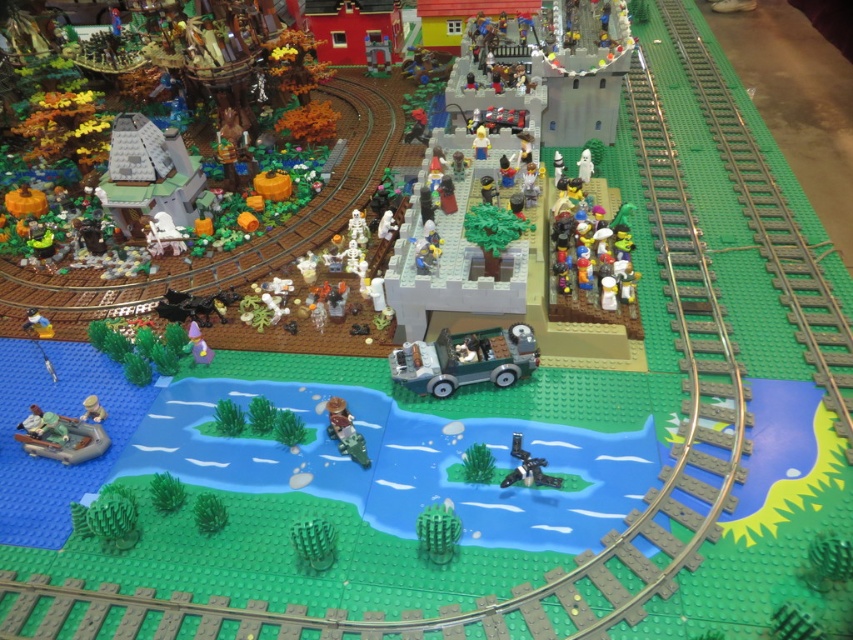
You are a Lego designer trying to place both the light tan plastic figure at lower left and the light yellow plastic minifigure at center on a platform that can only hold figures with the same width. Which figure should you adjust to match the other in width?

The light tan plastic figure at lower left is wider than the light yellow plastic minifigure at center. To make them the same width, you should adjust the light tan plastic figure at lower left to be narrower or the light yellow plastic minifigure at center to be wider.

You are a Lego figure standing next to the light tan plastic figure at lower left. You want to take a photo of yourself using the camera. Can you reach the camera without moving?

The light tan plastic figure at lower left and camera are 1.46 meters apart. Since you are a Lego figure, your arm length is likely shorter than 1.46 meters, so you cannot reach the camera without moving.